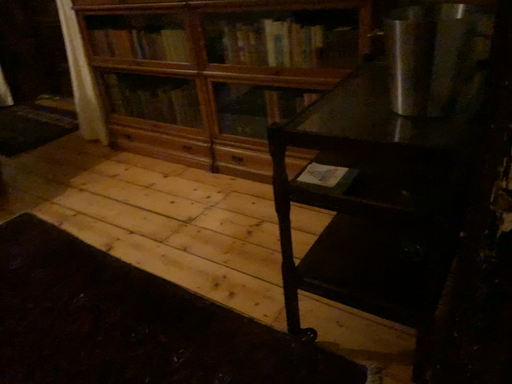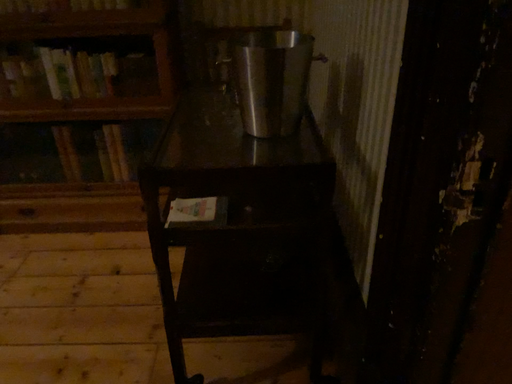
Question: How did the camera likely rotate when shooting the video?

Choices:
 (A) rotated upward
 (B) rotated downward

Answer: (A)